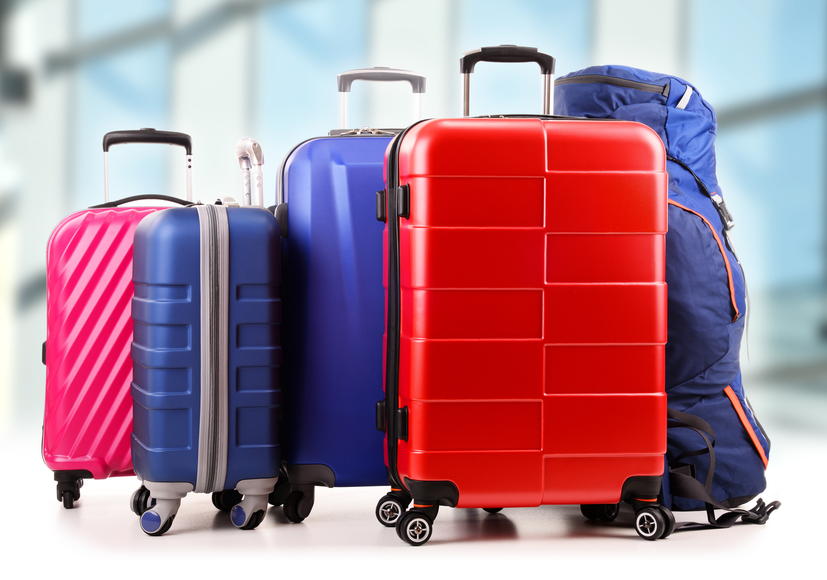
Locate an element on the screen. Image resolution: width=827 pixels, height=580 pixels. adjustable handles is located at coordinates (161, 136), (256, 150), (367, 70), (531, 55).